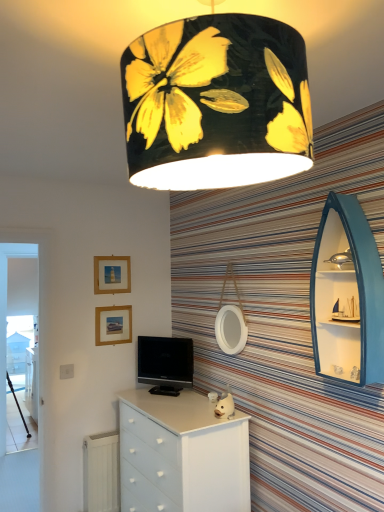
Question: Can you confirm if white glossy chest of drawers at center is taller than matte gold picture frame at upper left, the first picture frame in the top-to-bottom sequence?

Choices:
 (A) no
 (B) yes

Answer: (B)

Question: Can you confirm if white glossy chest of drawers at center is thinner than matte gold picture frame at upper left, the first picture frame in the top-to-bottom sequence?

Choices:
 (A) yes
 (B) no

Answer: (B)

Question: Is white glossy chest of drawers at center looking in the opposite direction of matte gold picture frame at upper left, the first picture frame in the top-to-bottom sequence?

Choices:
 (A) yes
 (B) no

Answer: (B)

Question: From the image's perspective, is white glossy chest of drawers at center over matte gold picture frame at upper left, the first picture frame in the top-to-bottom sequence?

Choices:
 (A) yes
 (B) no

Answer: (B)

Question: Can you confirm if white glossy chest of drawers at center is smaller than matte gold picture frame at upper left, the first picture frame in the top-to-bottom sequence?

Choices:
 (A) no
 (B) yes

Answer: (A)

Question: Is black fabric lampshade at upper center inside or outside of wooden tripod at left?

Choices:
 (A) outside
 (B) inside

Answer: (A)

Question: Does point (198, 93) appear closer or farther from the camera than point (19, 408)?

Choices:
 (A) farther
 (B) closer

Answer: (B)

Question: From a real-world perspective, is black fabric lampshade at upper center above or below wooden tripod at left?

Choices:
 (A) below
 (B) above

Answer: (B)

Question: Considering the positions of black fabric lampshade at upper center and wooden tripod at left in the image, is black fabric lampshade at upper center bigger or smaller than wooden tripod at left?

Choices:
 (A) small
 (B) big

Answer: (B)

Question: Is white matte mirror at center to the left or to the right of white glossy chest of drawers at center in the image?

Choices:
 (A) right
 (B) left

Answer: (A)

Question: From the image's perspective, is white matte mirror at center located above or below white glossy chest of drawers at center?

Choices:
 (A) above
 (B) below

Answer: (A)

Question: Which is correct: white matte mirror at center is inside white glossy chest of drawers at center, or outside of it?

Choices:
 (A) outside
 (B) inside

Answer: (A)

Question: Considering the positions of white matte mirror at center and white glossy chest of drawers at center in the image, is white matte mirror at center wider or thinner than white glossy chest of drawers at center?

Choices:
 (A) wide
 (B) thin

Answer: (B)

Question: Would you say matte gold picture frame at upper left, the first picture frame in the top-to-bottom sequence, is inside or outside white glossy chest of drawers at center?

Choices:
 (A) outside
 (B) inside

Answer: (A)

Question: From a real-world perspective, is matte gold picture frame at upper left, the first picture frame in the top-to-bottom sequence, above or below white glossy chest of drawers at center?

Choices:
 (A) above
 (B) below

Answer: (A)